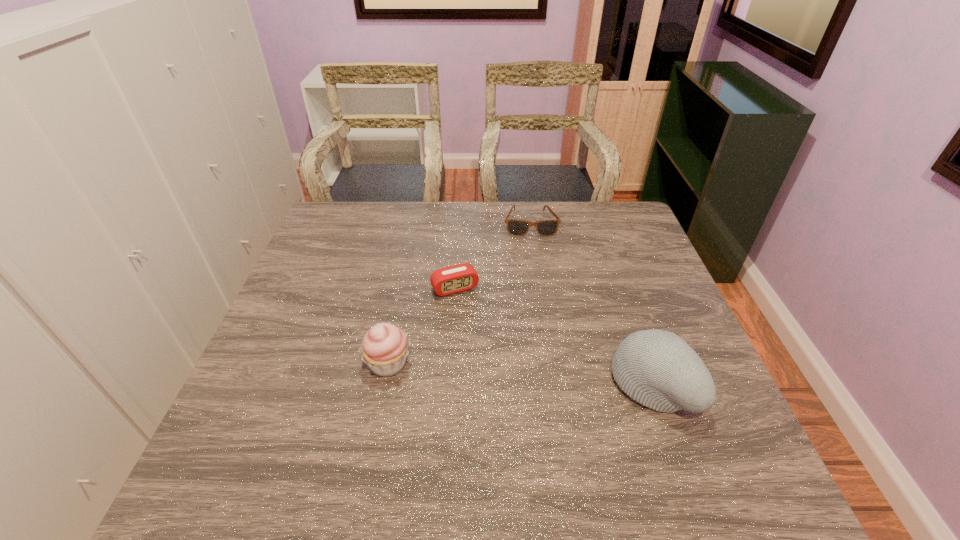
The height and width of the screenshot is (540, 960). Find the location of `free spot on the desktop that is between the leftmost object and the beanie and is positioned on the frames of the sunglasses`. free spot on the desktop that is between the leftmost object and the beanie and is positioned on the frames of the sunglasses is located at coordinates (549, 376).

Identify the location of free spot on the desktop that is between the cupcake and the beanie and is positioned on the front-facing side of the second farthest object. (497, 372).